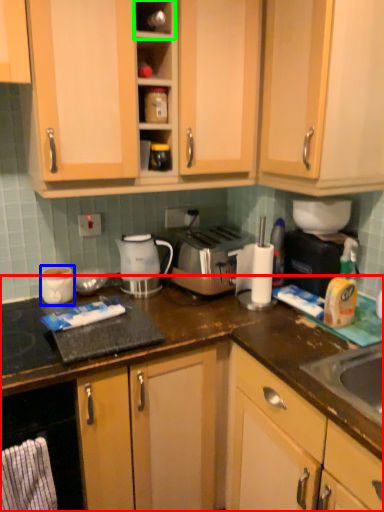
Question: Considering the real-world distances, which object is closest to cabinetry (highlighted by a red box)? appliance (highlighted by a blue box) or shelf (highlighted by a green box).

Choices:
 (A) appliance
 (B) shelf

Answer: (A)